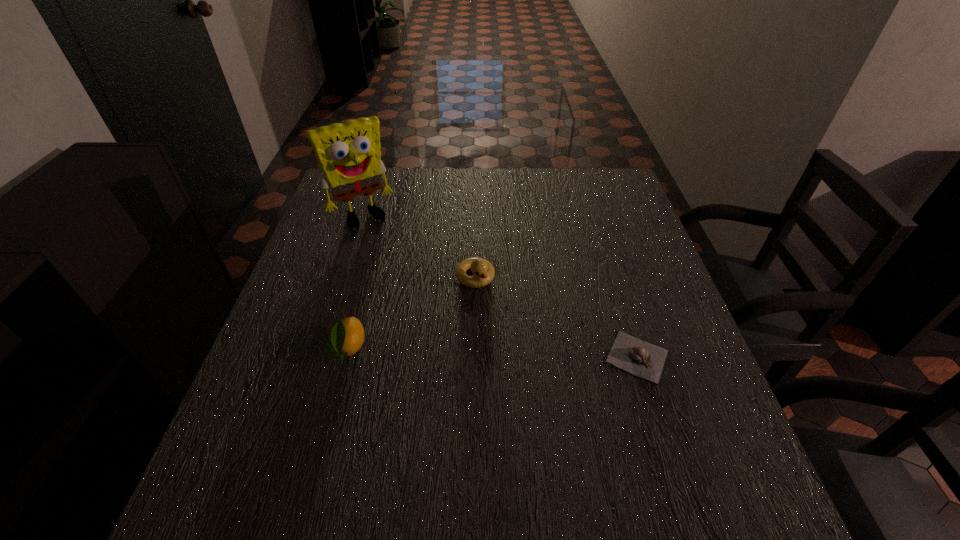
Locate an element on the screen. The height and width of the screenshot is (540, 960). vacant space located on the face of the sponge is located at coordinates (403, 273).

The height and width of the screenshot is (540, 960). Identify the location of vacant space located on the face of the sponge. (382, 240).

The image size is (960, 540). Find the location of `free space located 0.080m at the beak of the third object from left to right`. free space located 0.080m at the beak of the third object from left to right is located at coordinates (496, 315).

The width and height of the screenshot is (960, 540). Identify the location of free space located at the beak of the third object from left to right. (516, 348).

Image resolution: width=960 pixels, height=540 pixels. I want to click on vacant area situated at the beak of the third object from left to right, so click(x=524, y=362).

Where is `object that is positioned at the far edge`? object that is positioned at the far edge is located at coordinates (349, 155).

Locate an element on the screen. The width and height of the screenshot is (960, 540). lemon that is at the left edge is located at coordinates (347, 336).

The image size is (960, 540). I want to click on sponge that is at the left edge, so click(x=349, y=155).

The image size is (960, 540). Identify the location of object that is positioned at the right edge. (646, 360).

I want to click on object that is positioned at the far left corner, so click(349, 155).